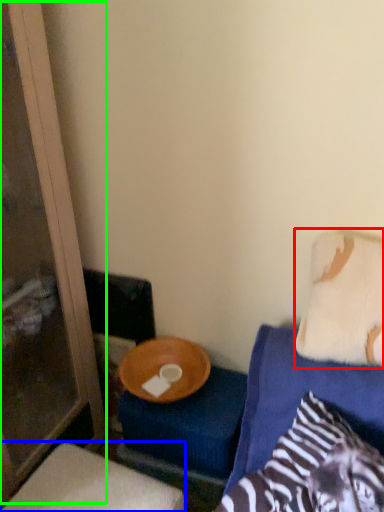
Question: Which is farther away from pillow (highlighted by a red box)? furniture (highlighted by a blue box) or screen door (highlighted by a green box)?

Choices:
 (A) furniture
 (B) screen door

Answer: (B)